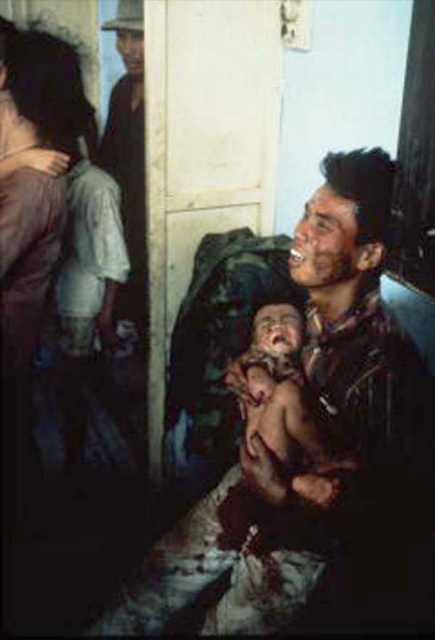
Question: Which point appears closest to the camera in this image?

Choices:
 (A) (395, 422)
 (B) (6, 292)

Answer: (A)

Question: From the image, what is the correct spatial relationship of dirty brown shirt at center in relation to skinny baby at center?

Choices:
 (A) above
 (B) below

Answer: (B)

Question: Can you confirm if dirty brown shirt at center is smaller than matte purple shirt at left?

Choices:
 (A) yes
 (B) no

Answer: (A)

Question: Which of the following is the closest to the observer?

Choices:
 (A) dirty brown shirt at center
 (B) matte purple shirt at left
 (C) skinny baby at center

Answer: (C)

Question: Which is nearer to the matte purple shirt at left?

Choices:
 (A) dirty brown shirt at center
 (B) skinny baby at center

Answer: (A)

Question: Is dirty brown shirt at center to the right of skinny baby at center from the viewer's perspective?

Choices:
 (A) yes
 (B) no

Answer: (A)